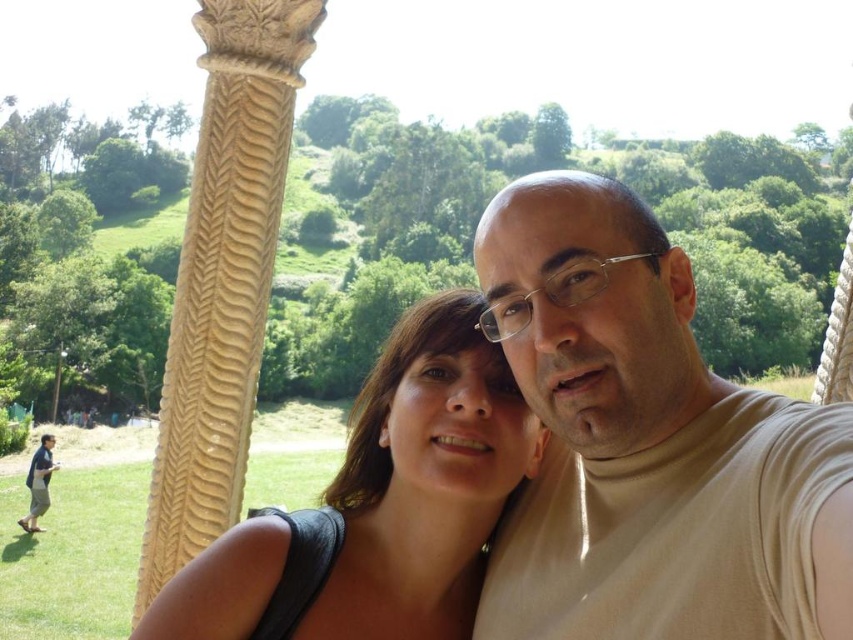
Question: Among these objects, which one is farthest from the camera?

Choices:
 (A) blue denim jeans at lower left
 (B) beige turtleneck at center

Answer: (A)

Question: Does matte black hair at center have a greater width compared to blue denim jeans at lower left?

Choices:
 (A) no
 (B) yes

Answer: (B)

Question: Which object is farther from the camera taking this photo?

Choices:
 (A) matte black hair at center
 (B) beige turtleneck at center

Answer: (A)

Question: Does beige turtleneck at center appear under blue denim jeans at lower left?

Choices:
 (A) no
 (B) yes

Answer: (A)

Question: Can you confirm if beige turtleneck at center is positioned above matte black hair at center?

Choices:
 (A) no
 (B) yes

Answer: (B)

Question: Which point is closer to the camera?

Choices:
 (A) (788, 612)
 (B) (36, 504)
 (C) (221, 609)

Answer: (A)